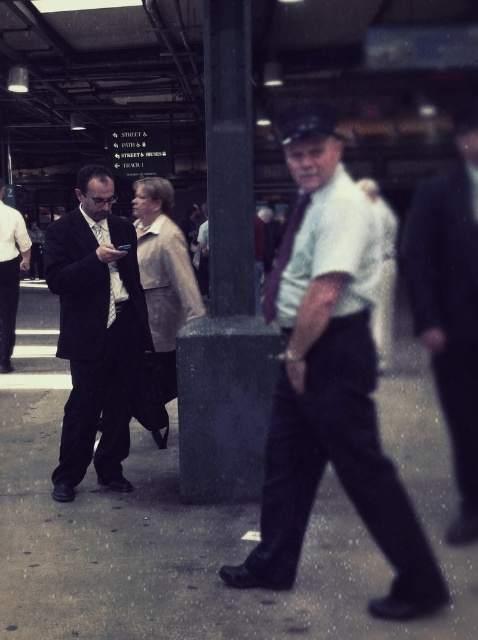
Question: Can you confirm if matte black suit at left is thinner than matte black tie at left?

Choices:
 (A) yes
 (B) no

Answer: (B)

Question: Based on their relative distances, which object is nearer to the white shirt at center?

Choices:
 (A) matte black tie at left
 (B) dark blue suit at center

Answer: (A)

Question: Which is nearer to the concrete sidewalk at center?

Choices:
 (A) dark suit at left
 (B) matte black suit at left
 (C) dark blue suit at center
 (D) white shirt at center

Answer: (A)

Question: Does concrete sidewalk at center appear under white shirt at center?

Choices:
 (A) no
 (B) yes

Answer: (B)

Question: Does dark suit at left appear under matte black suit at left?

Choices:
 (A) yes
 (B) no

Answer: (A)

Question: Among these points, which one is nearest to the camera?

Choices:
 (A) (459, 445)
 (B) (65, 285)
 (C) (291, 285)
 (D) (15, 308)

Answer: (C)